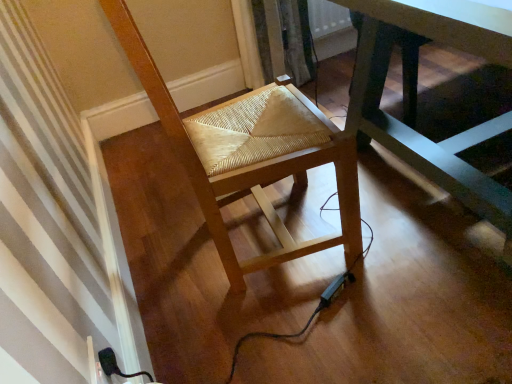
Question: Is dark green wooden table at center shorter than natural wood woven seat at center?

Choices:
 (A) yes
 (B) no

Answer: (A)

Question: Is dark green wooden table at center oriented away from natural wood woven seat at center?

Choices:
 (A) no
 (B) yes

Answer: (A)

Question: Can you confirm if dark green wooden table at center is taller than natural wood woven seat at center?

Choices:
 (A) yes
 (B) no

Answer: (B)

Question: From a real-world perspective, is dark green wooden table at center physically above natural wood woven seat at center?

Choices:
 (A) yes
 (B) no

Answer: (B)

Question: Considering the relative sizes of dark green wooden table at center and natural wood woven seat at center in the image provided, is dark green wooden table at center thinner than natural wood woven seat at center?

Choices:
 (A) yes
 (B) no

Answer: (B)

Question: From the image's perspective, is dark green wooden table at center located beneath natural wood woven seat at center?

Choices:
 (A) no
 (B) yes

Answer: (A)

Question: Does natural wood woven seat at center touch dark green wooden table at center?

Choices:
 (A) yes
 (B) no

Answer: (B)

Question: Can you confirm if natural wood woven seat at center is wider than dark green wooden table at center?

Choices:
 (A) yes
 (B) no

Answer: (B)

Question: From the image's perspective, is natural wood woven seat at center located beneath dark green wooden table at center?

Choices:
 (A) no
 (B) yes

Answer: (B)

Question: Is natural wood woven seat at center positioned with its back to dark green wooden table at center?

Choices:
 (A) yes
 (B) no

Answer: (B)

Question: From a real-world perspective, is natural wood woven seat at center beneath dark green wooden table at center?

Choices:
 (A) no
 (B) yes

Answer: (A)

Question: Is natural wood woven seat at center further to camera compared to dark green wooden table at center?

Choices:
 (A) no
 (B) yes

Answer: (B)

Question: From a real-world perspective, relative to dark green wooden table at center, is natural wood woven seat at center vertically above or below?

Choices:
 (A) below
 (B) above

Answer: (B)